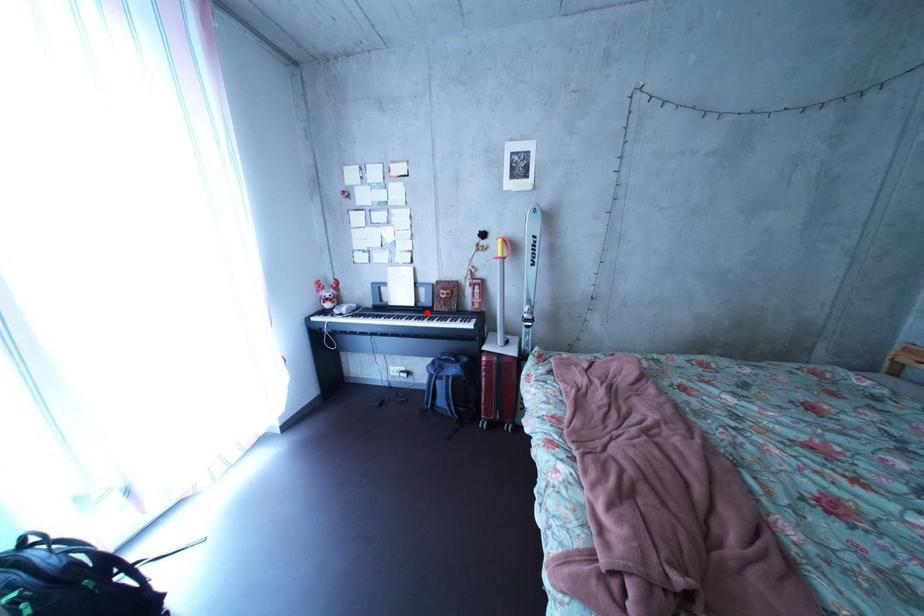
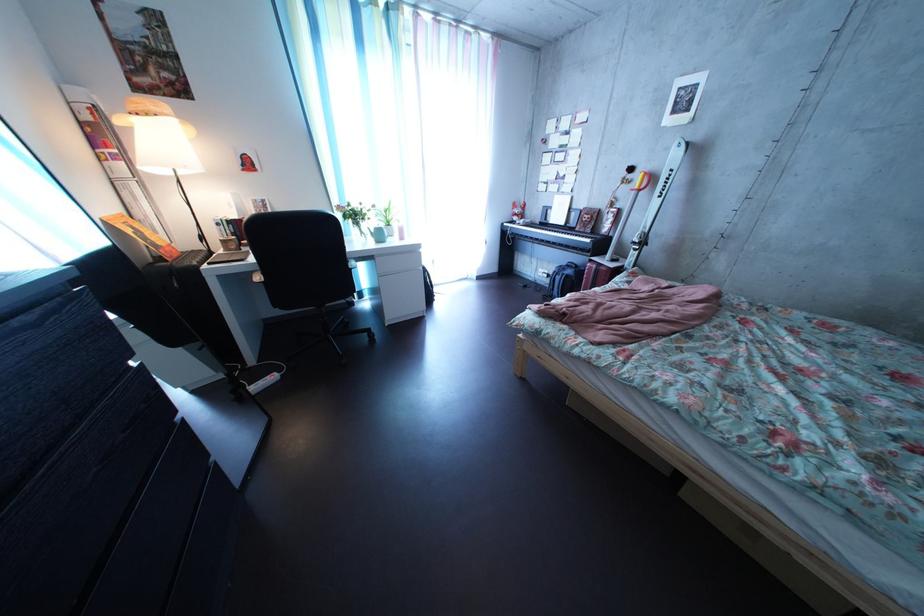
Where in the second image is the point corresponding to the highlighted location from the first image?

(577, 232)